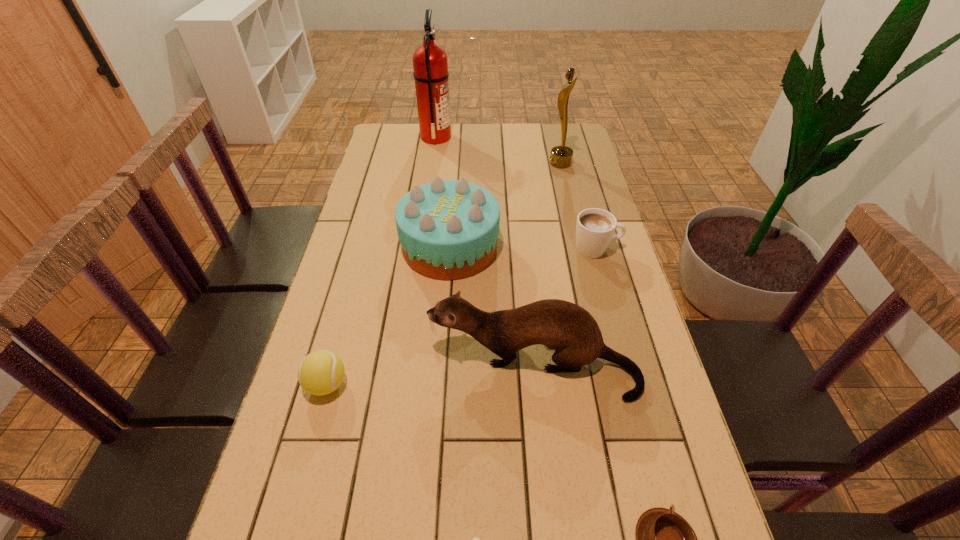
Identify which object is the seventh closest to the cake. Please provide its 2D coordinates. Your answer should be formatted as a tuple, i.e. [(x, y)], where the tuple contains the x and y coordinates of a point satisfying the conditions above.

[(476, 539)]

Identify the location of cappuccino that is the closest to the cake. (595, 227).

Locate which cappuccino is the second closest to the brown cappuccino. Please provide its 2D coordinates. Your answer should be formatted as a tuple, i.e. [(x, y)], where the tuple contains the x and y coordinates of a point satisfying the conditions above.

[(595, 227)]